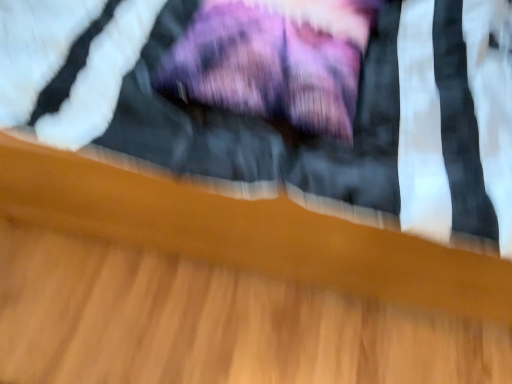
I want to click on purple tie-dye pillow at center, so click(274, 61).

What do you see at coordinates (274, 61) in the screenshot? I see `purple tie-dye pillow at center` at bounding box center [274, 61].

At what (x,y) coordinates should I click in order to perform the action: click on purple tie-dye pillow at center. Please return your answer as a coordinate pair (x, y). This screenshot has height=384, width=512. Looking at the image, I should click on (274, 61).